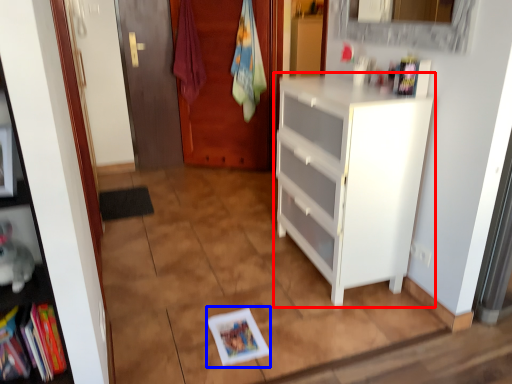
Question: Among these objects, which one is nearest to the camera, cabinetry (highlighted by a red box) or book (highlighted by a blue box)?

Choices:
 (A) cabinetry
 (B) book

Answer: (A)